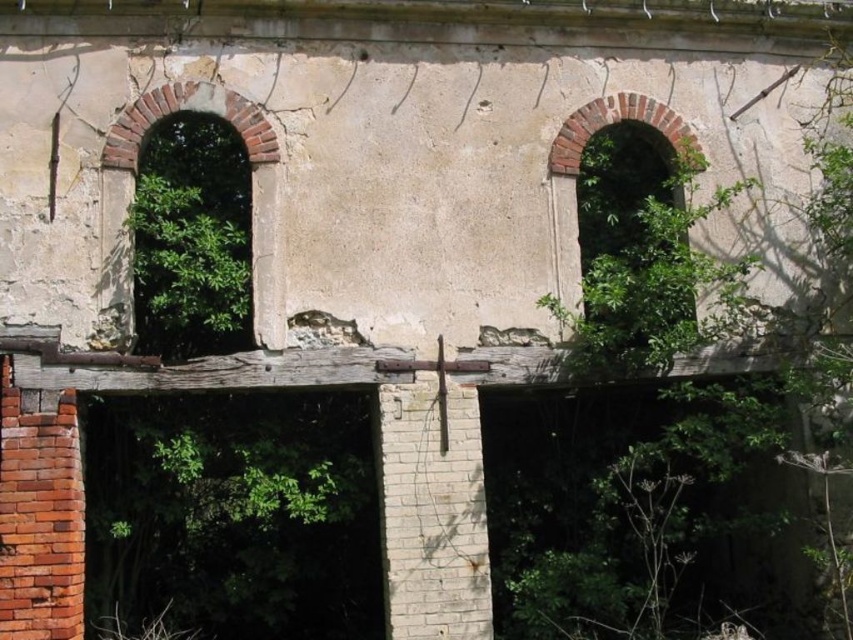
You are standing in front of the old building and want to touch both the green leafy tree at left and the brick textured window at left. Which object will you reach first?

The green leafy tree at left is closer to the viewer than the brick textured window at left, so you will reach the green leafy tree at left first.

You are standing 25 feet away from the green leafy tree at left. The building facade is between you and the tree. Is the building facade closer to you or the tree?

The building facade is closer to you than the green leafy tree at left because you are standing 25 feet away from the tree, meaning the facade is between you and the tree.

You are standing in front of the old building and notice two elements on the left side of the facade. Which one is positioned further to the left between the green leafy tree at left and the brick textured window at left?

The green leafy tree at left is positioned further to the left than the brick textured window at left.